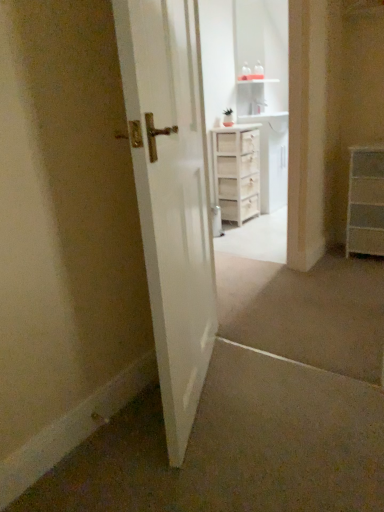
Question: Looking at the image, does white glossy door at center seem bigger or smaller compared to white wood cabinet at center?

Choices:
 (A) big
 (B) small

Answer: (B)

Question: From the image's perspective, relative to white wood cabinet at center, is white glossy door at center above or below?

Choices:
 (A) below
 (B) above

Answer: (A)

Question: Which object is positioned closest to the white wood cabinet at upper center?

Choices:
 (A) white wood cabinet at center
 (B) white glossy door at center
 (C) white wooden chest of drawers at center, placed as the second chest of drawers when sorted from front to back
 (D) white matte chest of drawers at right, placed as the 2th chest of drawers when sorted from back to front

Answer: (A)

Question: Which of these objects is positioned farthest from the white glossy door at center?

Choices:
 (A) white matte chest of drawers at right, which is the first chest of drawers in front-to-back order
 (B) white wooden chest of drawers at center, placed as the second chest of drawers when sorted from front to back
 (C) white wood cabinet at center
 (D) white wood cabinet at upper center

Answer: (C)